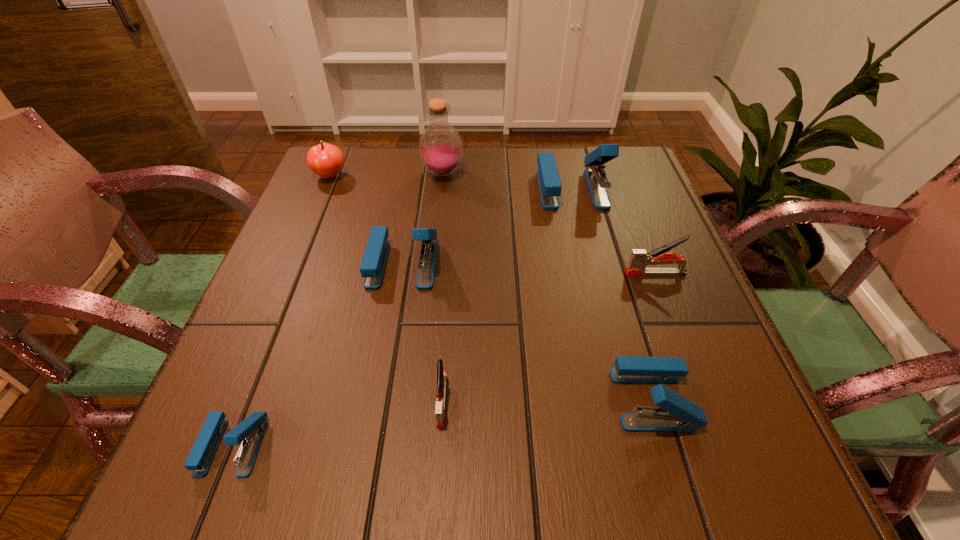
Locate an element on the screen. The width and height of the screenshot is (960, 540). object present at the near left corner is located at coordinates (251, 431).

The height and width of the screenshot is (540, 960). I want to click on object present at the far right corner, so click(549, 182).

In the image, there is a desktop. At what (x,y) coordinates should I click in order to perform the action: click on blank space at the far edge. Please return your answer as a coordinate pair (x, y). Image resolution: width=960 pixels, height=540 pixels. Looking at the image, I should click on (568, 161).

Image resolution: width=960 pixels, height=540 pixels. Identify the location of vacant space at the left edge of the desktop. (x=311, y=235).

In the image, there is a desktop. Where is `vacant area at the right edge`? vacant area at the right edge is located at coordinates (634, 237).

Find the location of a particular element. This screenshot has height=540, width=960. vacant point at the far left corner is located at coordinates (373, 176).

Locate an element on the screen. This screenshot has height=540, width=960. vacant space at the near left corner is located at coordinates (269, 465).

This screenshot has width=960, height=540. I want to click on vacant space that is in between the bigger gray stapler and the red apple, so click(x=492, y=225).

Where is `free space between the third biggest blue stapler and the purple bottle`? free space between the third biggest blue stapler and the purple bottle is located at coordinates (548, 286).

This screenshot has width=960, height=540. In order to click on free space that is in between the second biggest blue stapler and the purple bottle in this screenshot , I will do `click(422, 219)`.